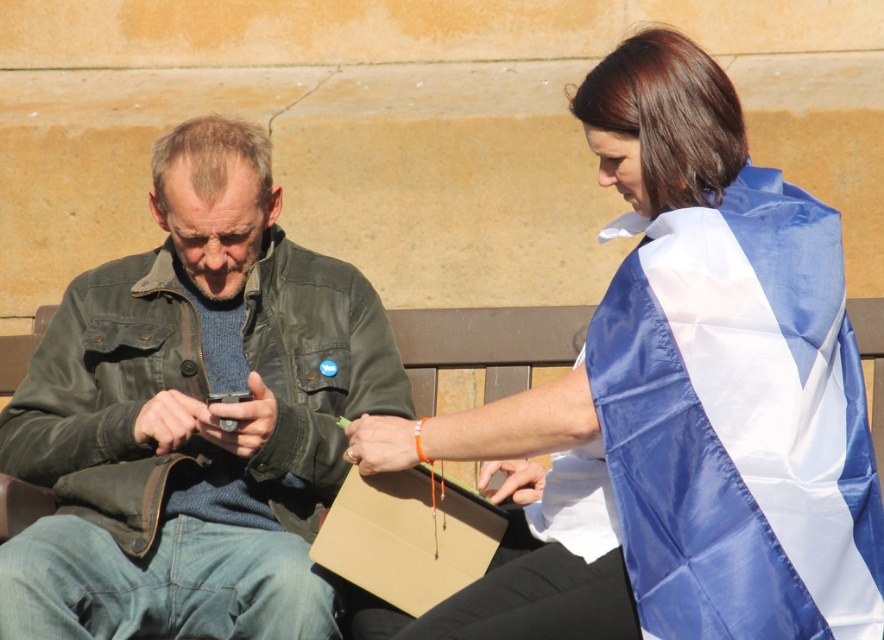
Question: Does blue satin flag at upper right come behind leather jacket at left?

Choices:
 (A) yes
 (B) no

Answer: (B)

Question: Can you confirm if blue satin flag at upper right is positioned above leather jacket at left?

Choices:
 (A) no
 (B) yes

Answer: (B)

Question: Among these objects, which one is farthest from the camera?

Choices:
 (A) leather jacket at left
 (B) blue satin flag at upper right

Answer: (A)

Question: Can you confirm if blue satin flag at upper right is thinner than leather jacket at left?

Choices:
 (A) no
 (B) yes

Answer: (A)